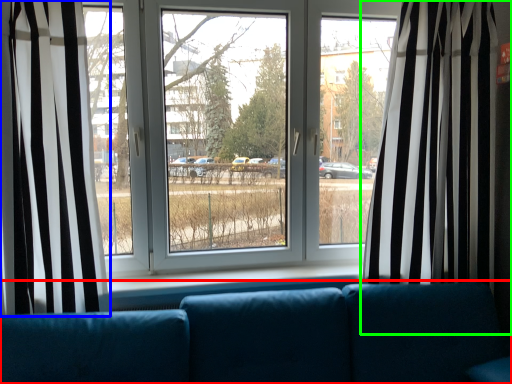
Question: Estimate the real-world distances between objects in this image. Which object is farther from studio couch (highlighted by a red box), curtain (highlighted by a blue box) or curtain (highlighted by a green box)?

Choices:
 (A) curtain
 (B) curtain

Answer: (A)